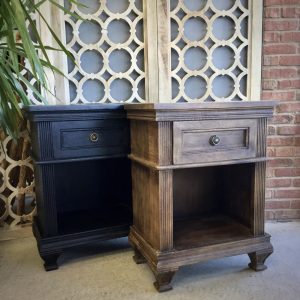
Image resolution: width=300 pixels, height=300 pixels. Find the location of `drawer`. drawer is located at coordinates (60, 157).